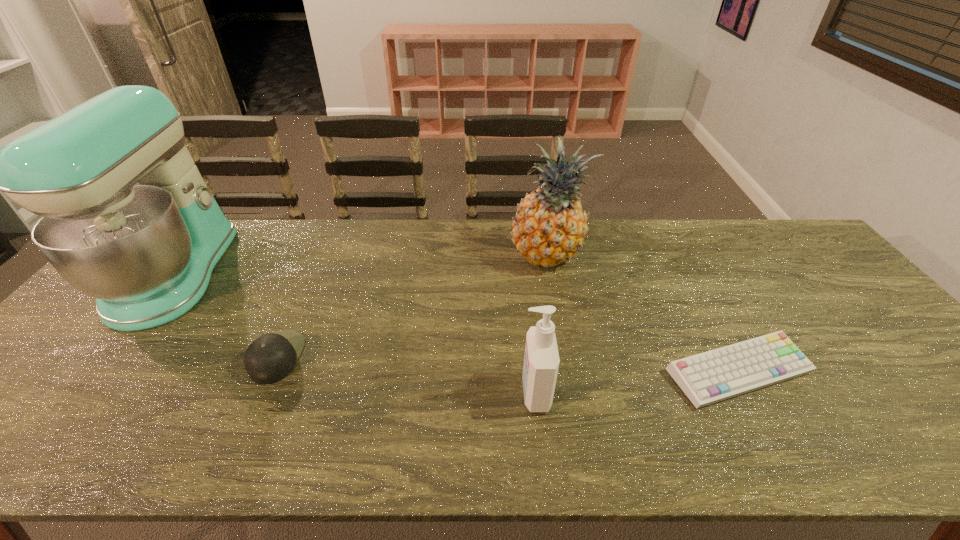
I want to click on blank region between the pineapple and the leftmost object, so click(362, 265).

Locate an element on the screen. This screenshot has height=540, width=960. empty space between the third shortest object and the leftmost object is located at coordinates (355, 333).

Choose which object is the third nearest neighbor to the second shortest object. Please provide its 2D coordinates. Your answer should be formatted as a tuple, i.e. [(x, y)], where the tuple contains the x and y coordinates of a point satisfying the conditions above.

[(549, 227)]

Locate an element on the screen. This screenshot has width=960, height=540. object identified as the third closest to the pineapple is located at coordinates (270, 358).

Where is `vacant position in the image that satisfies the following two spatial constraints: 1. on the front side of the pineapple; 2. at the base of the tallest object`? vacant position in the image that satisfies the following two spatial constraints: 1. on the front side of the pineapple; 2. at the base of the tallest object is located at coordinates (551, 274).

Find the location of a particular element. blank area in the image that satisfies the following two spatial constraints: 1. at the base of the mixer; 2. on the back side of the computer keyboard is located at coordinates (98, 372).

Where is `free space that satisfies the following two spatial constraints: 1. on the brim of the shortest object; 2. on the left side of the fourth tallest object`? The image size is (960, 540). free space that satisfies the following two spatial constraints: 1. on the brim of the shortest object; 2. on the left side of the fourth tallest object is located at coordinates (271, 372).

Identify the location of vacant space that satisfies the following two spatial constraints: 1. on the brim of the fourth tallest object; 2. on the left side of the computer keyboard. (271, 372).